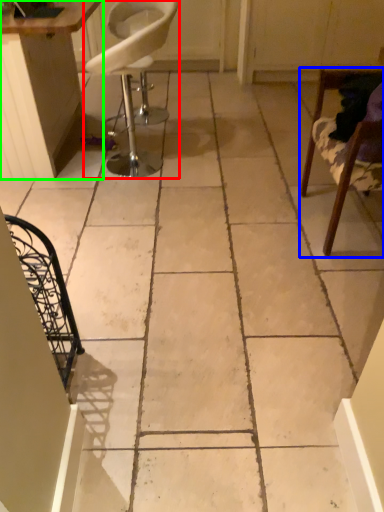
Question: Estimate the real-world distances between objects in this image. Which object is closer to chair (highlighted by a red box), chair (highlighted by a blue box) or table (highlighted by a green box)?

Choices:
 (A) chair
 (B) table

Answer: (B)